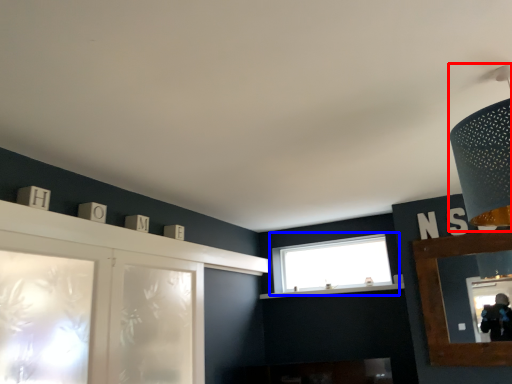
Question: Which of the following is the farthest to the observer, light fixture (highlighted by a red box) or window (highlighted by a blue box)?

Choices:
 (A) light fixture
 (B) window

Answer: (B)